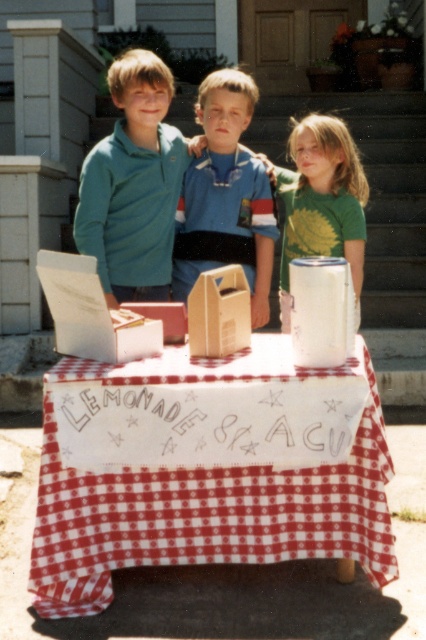
You are a customer approaching the lemonade stand. You see the red checkered tablecloth at center and the blue fabric shirt at center. Which item is wider?

The red checkered tablecloth at center is wider than the blue fabric shirt at center.

You are a customer approaching the lemonade stand. You see the point marked at coordinates [203,508]. Where is this point located relative to the red checkered tablecloth at center?

The point marked at coordinates [203,508] is located on the red checkered tablecloth at center.